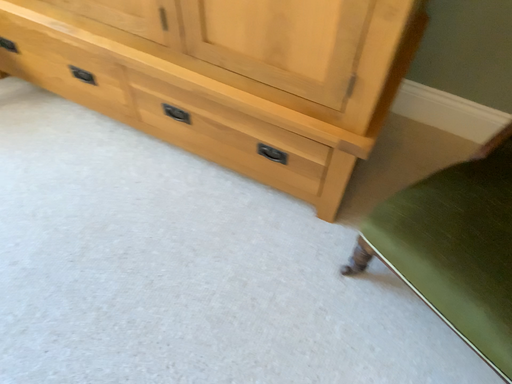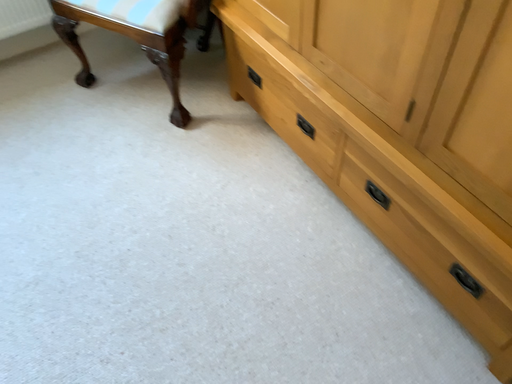
Question: How did the camera likely rotate when shooting the video?

Choices:
 (A) rotated left
 (B) rotated right

Answer: (A)